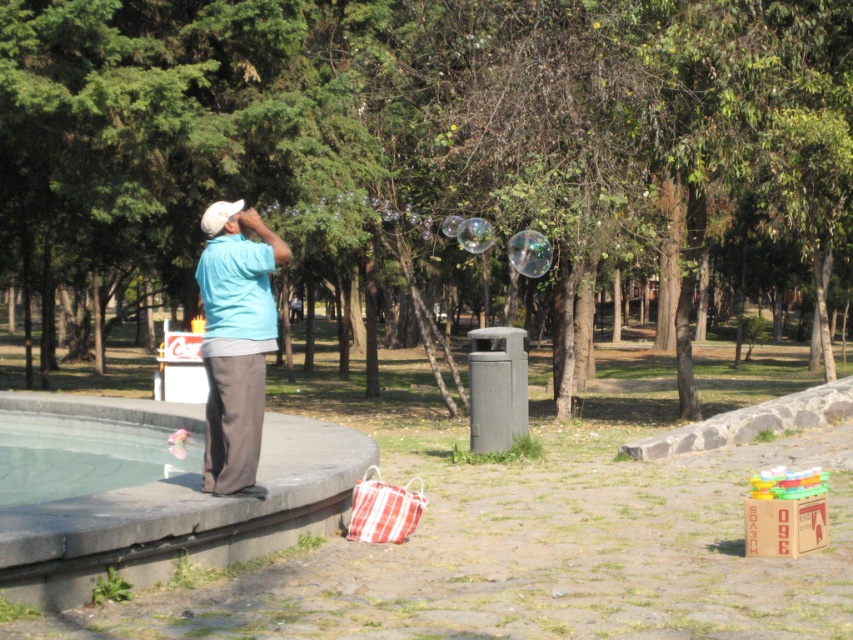
Which is above, matte blue shirt at center or transparent glass pool at lower left?

Positioned higher is matte blue shirt at center.

Does matte blue shirt at center have a lesser height compared to transparent glass pool at lower left?

No.

Measure the distance between matte blue shirt at center and camera.

matte blue shirt at center is 27.12 feet away from camera.

Where is `matte blue shirt at center`? matte blue shirt at center is located at coordinates (235, 342).